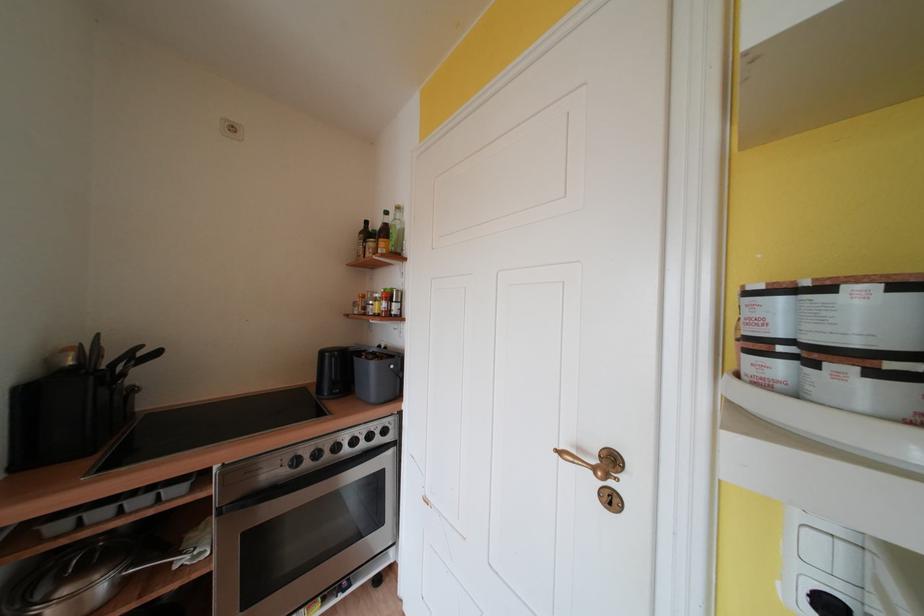
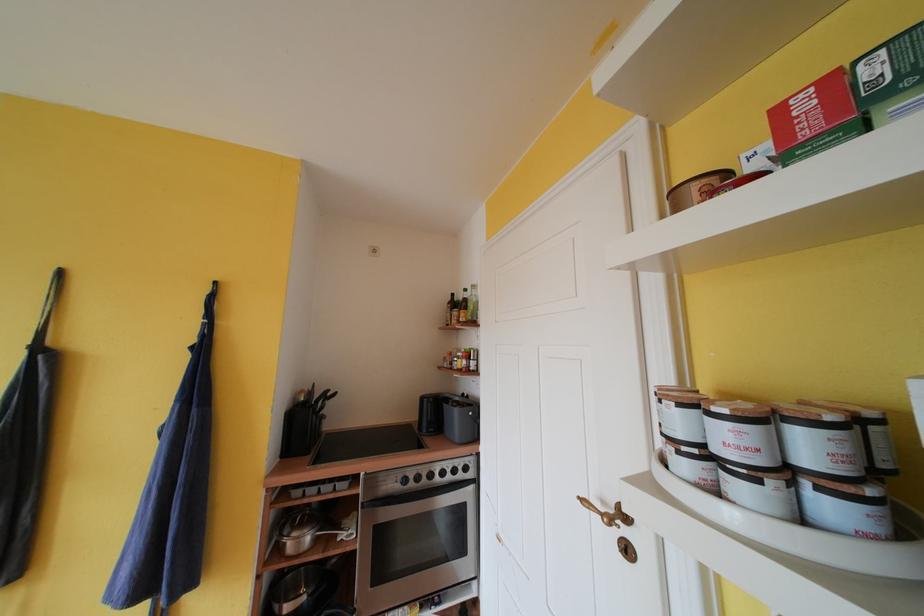
In the second image, find the point that corresponds to point 343,451 in the first image.

(436, 479)